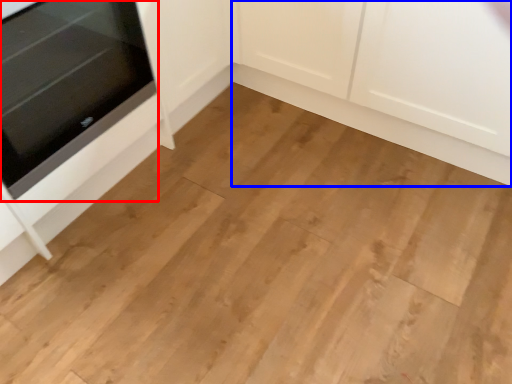
Question: Among these objects, which one is farthest to the camera, oven (highlighted by a red box) or cabinetry (highlighted by a blue box)?

Choices:
 (A) oven
 (B) cabinetry

Answer: (B)